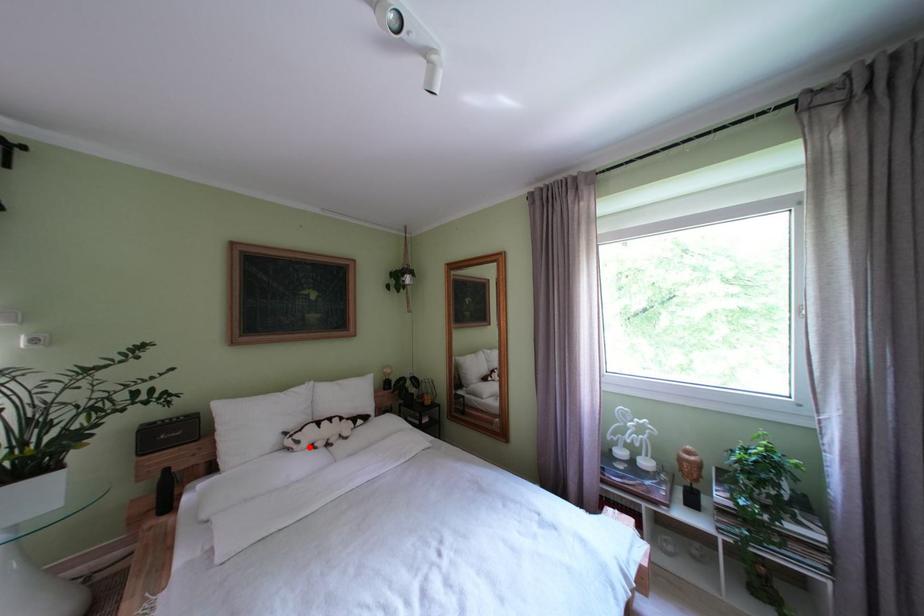
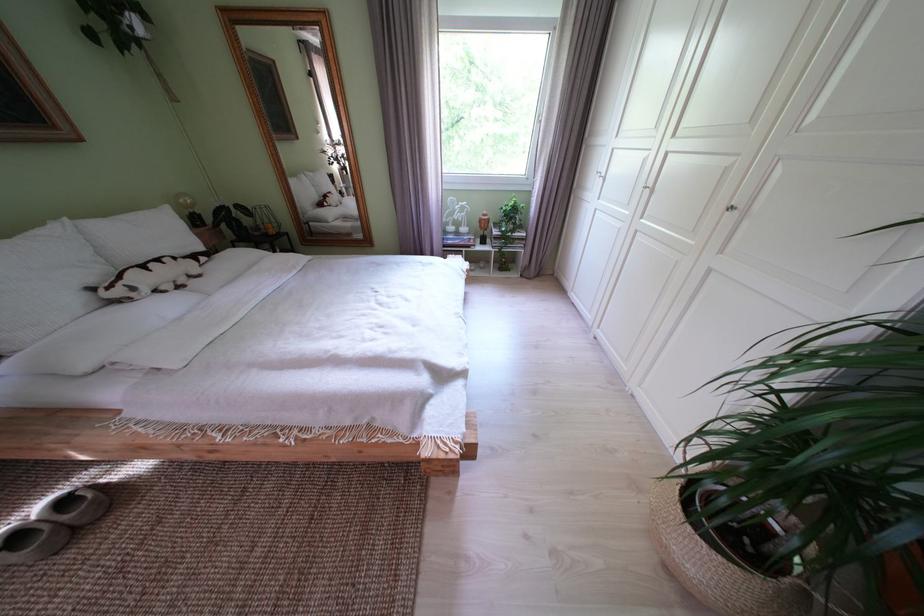
Question: A red point is marked in image1. In image2, is the corresponding 3D point closer to the camera or farther? Reply with the corresponding letter.

Choices:
 (A) The corresponding 3D point is closer.
 (B) The corresponding 3D point is farther.

Answer: (A)